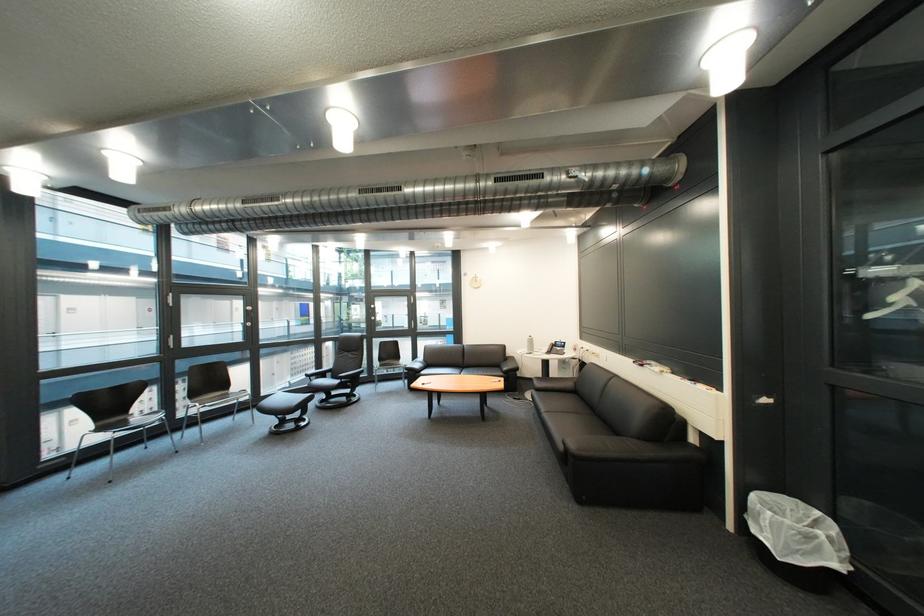
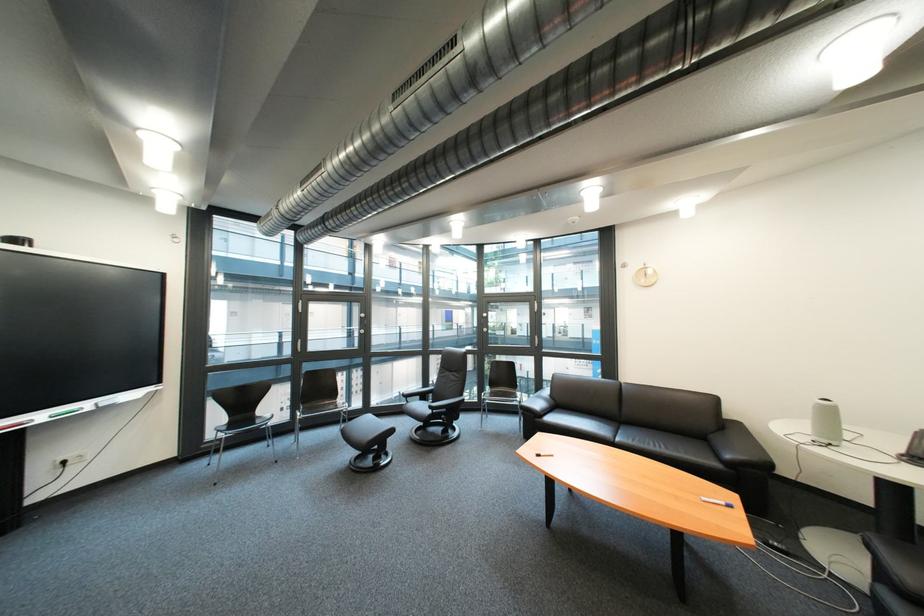
Where in the second image is the point corresponding to pixel 477 373 from the first image?

(634, 434)